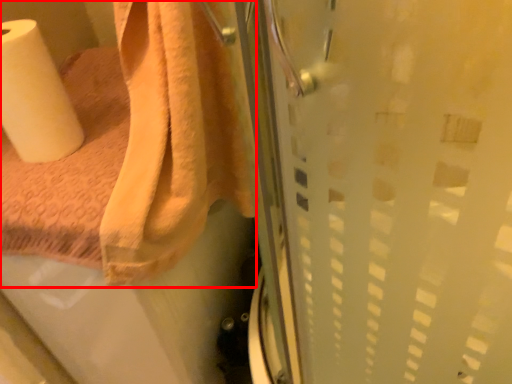
Question: Observing the image, what is the correct spatial positioning of towel (annotated by the red box) in reference to paper towel?

Choices:
 (A) left
 (B) right

Answer: (B)